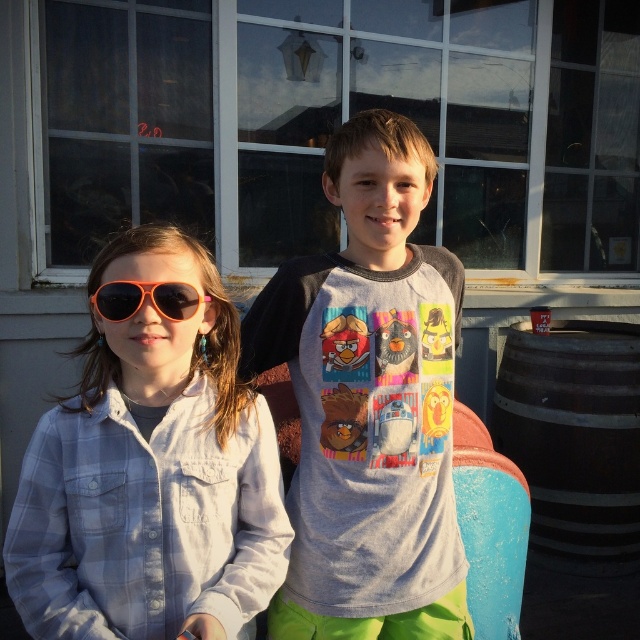
You are a photographer adjusting your camera to focus on two points in the image. The first point is point (106, 509) and the second is point (520, 388). Which point should you focus on first if you want to start with the one closer to you?

You should focus on point (106, 509) first because it is closer to the viewer than point (520, 388).

Based on the photo, you are a photographer trying to capture a clear shot of both the matte orange sunglasses at left and the brown wooden barrel at right. Since the barrel is in the background, will the sunglasses block the view of the barrel?

The matte orange sunglasses at left is in front of the brown wooden barrel at right, so it will block the view of the barrel. Adjust your angle to see around the sunglasses or move closer to the barrel to ensure both are visible.

You are standing in front of the building with the large windows and want to reach a specific point marked at coordinates point [168,262]. If you take a step forward of 1 meter, will you be closer to that point?

The point [168,262] is 1.37 meters from the viewer. Taking a step forward of 1 meter would bring you to 0.37 meters away, so yes, you will be closer to the point [168,262].